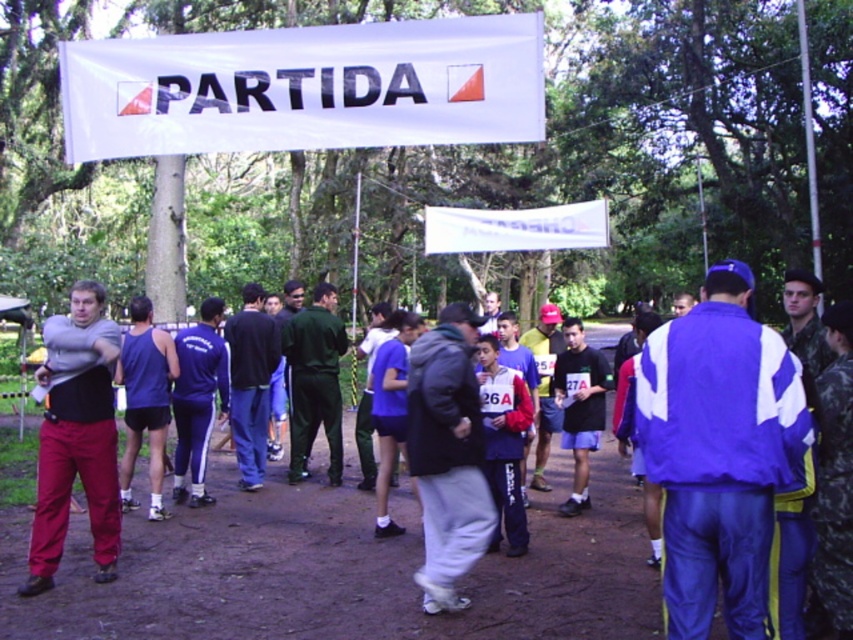
From the picture: Is green fabric pants at center thinner than matte gray hoodie at center?

Yes, green fabric pants at center is thinner than matte gray hoodie at center.

Which of these two, green fabric pants at center or matte gray hoodie at center, stands shorter?

With less height is matte gray hoodie at center.

At what (x,y) coordinates should I click in order to perform the action: click on green fabric pants at center. Please return your answer as a coordinate pair (x, y). Looking at the image, I should click on (315, 380).

Between matte gray shirt at left and green fabric pants at center, which one is positioned lower?

matte gray shirt at left

Can you confirm if matte gray shirt at left is positioned to the right of green fabric pants at center?

No, matte gray shirt at left is not to the right of green fabric pants at center.

Image resolution: width=853 pixels, height=640 pixels. In order to click on matte gray shirt at left in this screenshot , I will do `click(76, 460)`.

Does shiny blue tracksuit at center appear under gray fleece jacket at center?

Actually, shiny blue tracksuit at center is above gray fleece jacket at center.

Does shiny blue tracksuit at center appear on the right side of gray fleece jacket at center?

Correct, you'll find shiny blue tracksuit at center to the right of gray fleece jacket at center.

Where is `shiny blue tracksuit at center`? shiny blue tracksuit at center is located at coordinates (717, 451).